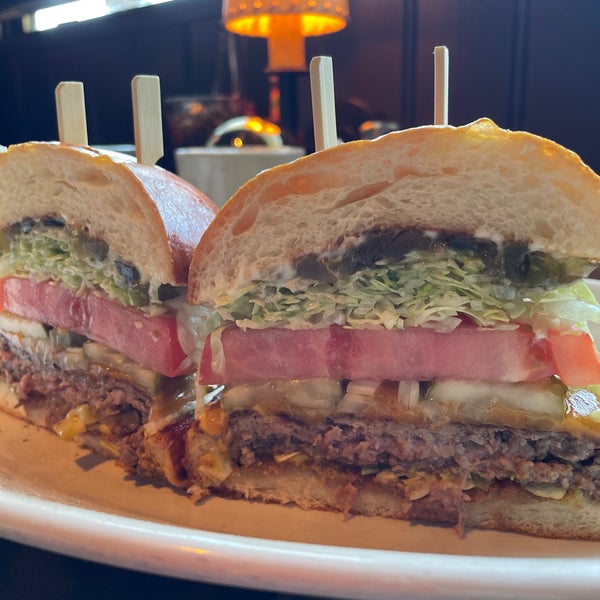
You are a GUI agent. You are given a task and a screenshot of the screen. Output one action in this format:
    pyautogui.click(x=<x>, y=<y>)
    Task: Click on the wood paneling
    
    Given the screenshot: What is the action you would take?
    pyautogui.click(x=490, y=81)